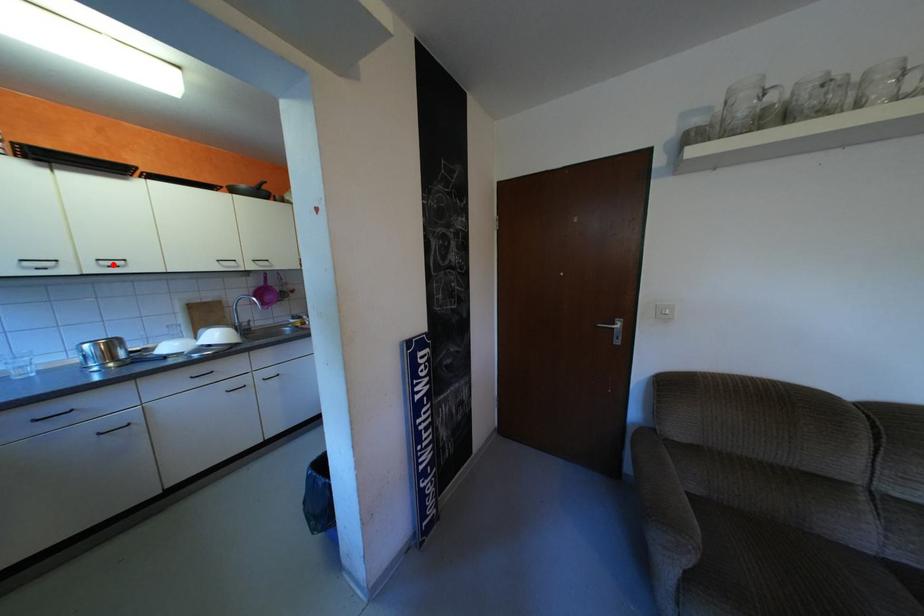
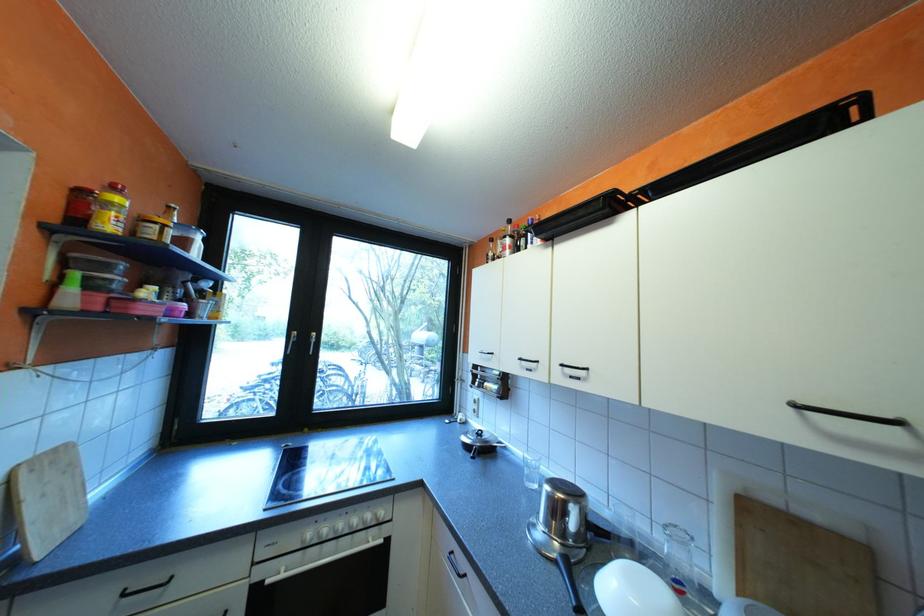
The point at the highlighted location is marked in the first image. Where is the corresponding point in the second image?

(576, 373)